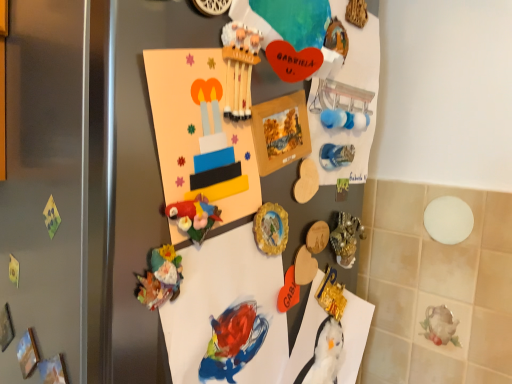
Question: Considering the positions of matte cardboard poster at center and matte paper postcard at center in the image, is matte cardboard poster at center taller or shorter than matte paper postcard at center?

Choices:
 (A) tall
 (B) short

Answer: (A)

Question: Which is correct: matte cardboard poster at center is inside matte paper postcard at center, or outside of it?

Choices:
 (A) outside
 (B) inside

Answer: (A)

Question: Estimate the real-world distances between objects in this image. Which object is closer to the plush fabric toy at lower left, marked as the 2th toy in a bottom-to-top arrangement?

Choices:
 (A) matte paper postcard at center
 (B) gold metallic vase at center-right, acting as the second art starting from the top
 (C) blue glossy magnet at upper right, which is the 1th art in top-to-bottom order
 (D) matte cardboard poster at center
 (E) matte orange heart at center, which is the third toy from front to back

Answer: (A)

Question: Which of these objects is positioned farthest from the matte paper postcard at center?

Choices:
 (A) matte cardboard poster at center
 (B) plush fabric toy at lower left, acting as the first toy starting from the front
 (C) matte orange heart at center, which appears as the 3th toy when viewed from the top
 (D) blue glossy magnet at upper right, which is the 1th art in top-to-bottom order
 (E) gold metallic button at center

Answer: (C)